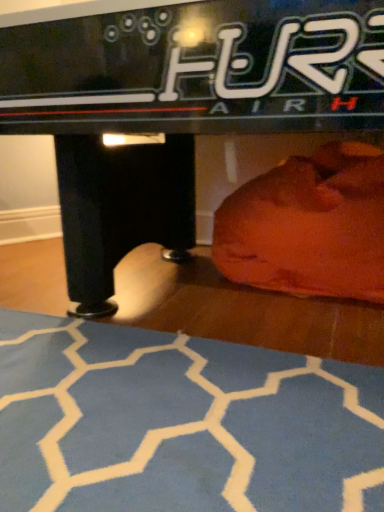
Question: Is orange fabric bean bag at lower right closer to camera compared to blue textured yoga mat at lower center?

Choices:
 (A) no
 (B) yes

Answer: (A)

Question: Could you tell me if orange fabric bean bag at lower right is facing blue textured yoga mat at lower center?

Choices:
 (A) yes
 (B) no

Answer: (A)

Question: Does orange fabric bean bag at lower right have a larger size compared to blue textured yoga mat at lower center?

Choices:
 (A) yes
 (B) no

Answer: (A)

Question: Can you confirm if orange fabric bean bag at lower right is shorter than blue textured yoga mat at lower center?

Choices:
 (A) yes
 (B) no

Answer: (B)

Question: Is orange fabric bean bag at lower right thinner than blue textured yoga mat at lower center?

Choices:
 (A) yes
 (B) no

Answer: (A)

Question: From the image's perspective, would you say orange fabric bean bag at lower right is positioned over blue textured yoga mat at lower center?

Choices:
 (A) no
 (B) yes

Answer: (B)

Question: Is the position of black glossy air hockey table at center more distant than that of blue textured yoga mat at lower center?

Choices:
 (A) no
 (B) yes

Answer: (B)

Question: Is black glossy air hockey table at center aimed at blue textured yoga mat at lower center?

Choices:
 (A) no
 (B) yes

Answer: (B)

Question: Is black glossy air hockey table at center smaller than blue textured yoga mat at lower center?

Choices:
 (A) yes
 (B) no

Answer: (B)

Question: Does black glossy air hockey table at center have a lesser width compared to blue textured yoga mat at lower center?

Choices:
 (A) yes
 (B) no

Answer: (B)

Question: Would you say black glossy air hockey table at center contains blue textured yoga mat at lower center?

Choices:
 (A) no
 (B) yes

Answer: (B)

Question: Is black glossy air hockey table at center shorter than blue textured yoga mat at lower center?

Choices:
 (A) yes
 (B) no

Answer: (B)

Question: Does black glossy air hockey table at center come behind orange fabric bean bag at lower right?

Choices:
 (A) yes
 (B) no

Answer: (B)